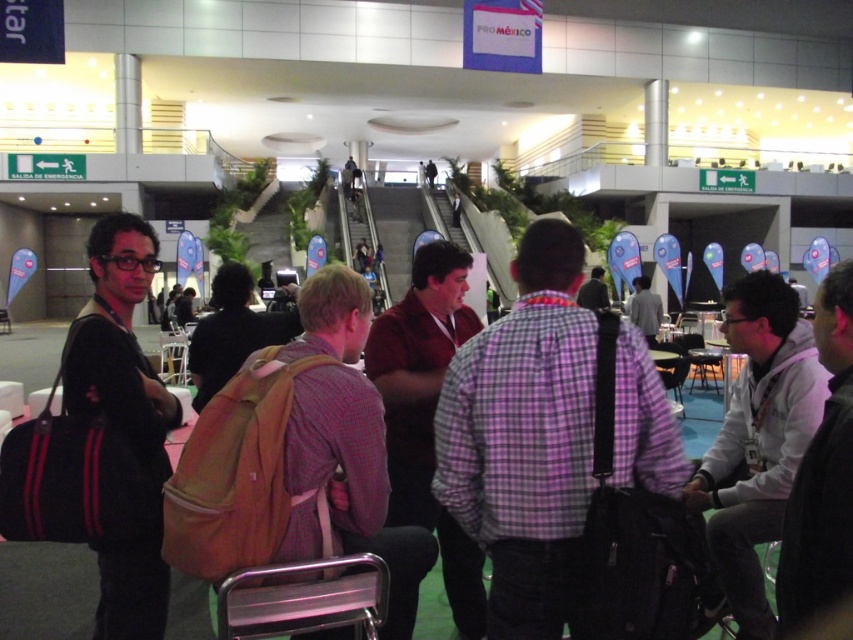
You are an event organizer who needs to arrange a photo backdrop in the event space. The backdrop requires a flat surface at least 1.2 meters in height. You see the light gray hoodie at lower right and the brown canvas backpack at center. Which object can provide the required height for the backdrop?

The light gray hoodie at lower right has a greater height compared to the brown canvas backpack at center, so it can provide the required height of at least 1.2 meters for the backdrop.

You are at the event and want to locate the light gray hoodie at lower right. Where exactly is it positioned in the image?

The light gray hoodie at lower right is located at point (758, 440) in the image.